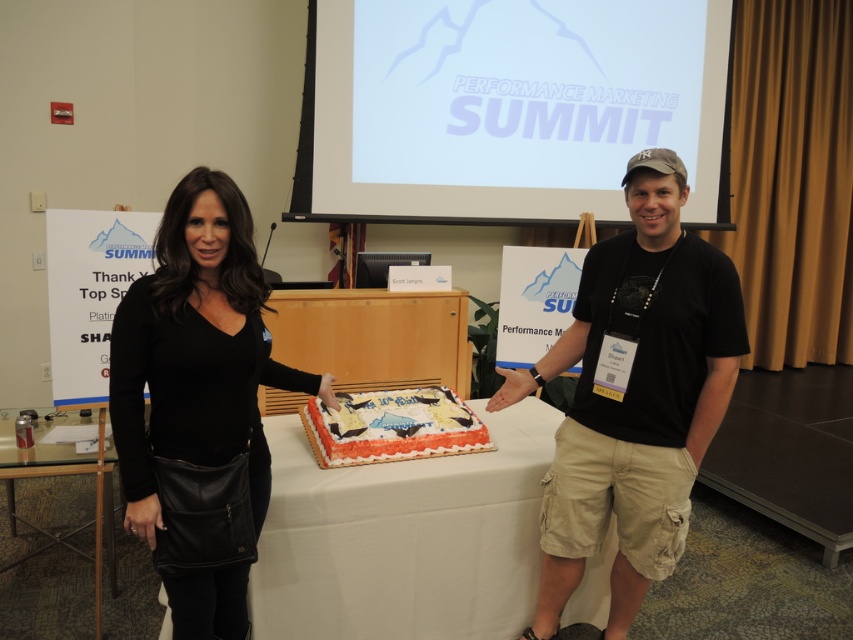
Does black leather purse at left have a smaller size compared to clear glass table at lower left?

Yes, black leather purse at left is smaller than clear glass table at lower left.

Between black leather purse at left and clear glass table at lower left, which one is positioned higher?

black leather purse at left is higher up.

The width and height of the screenshot is (853, 640). Describe the element at coordinates (199, 404) in the screenshot. I see `black leather purse at left` at that location.

Identify the location of black leather purse at left. (199, 404).

Looking at this image, who is shorter, black matte cake at center or white frosted cake at center?

With less height is white frosted cake at center.

Is black matte cake at center below white frosted cake at center?

Actually, black matte cake at center is above white frosted cake at center.

Where is `black matte cake at center`? This screenshot has height=640, width=853. black matte cake at center is located at coordinates (634, 396).

Can you confirm if white cloth at center is taller than clear glass table at lower left?

No, white cloth at center is not taller than clear glass table at lower left.

Who is more distant from viewer, (x=358, y=513) or (x=100, y=580)?

The point (x=100, y=580) is behind.

Does point (515, 557) lie behind point (15, 452)?

No, it is in front of (15, 452).

I want to click on white cloth at center, so click(403, 538).